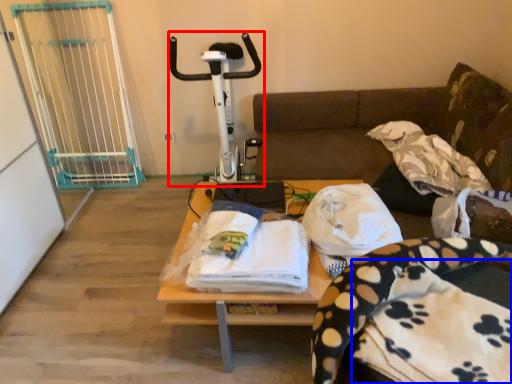
Question: Which object is closer to the camera taking this photo, sport equipment (highlighted by a red box) or blanket (highlighted by a blue box)?

Choices:
 (A) sport equipment
 (B) blanket

Answer: (B)